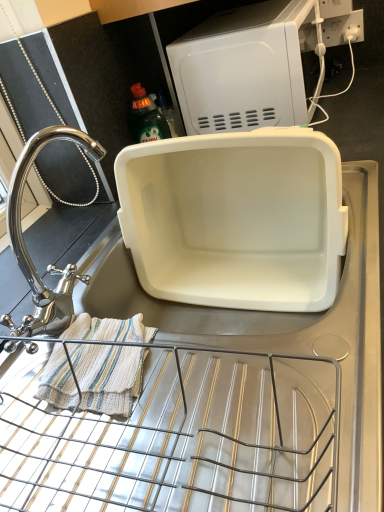
This screenshot has height=512, width=384. I want to click on polished chrome faucet at left, so click(26, 247).

This screenshot has width=384, height=512. What are the coordinates of `striped cotton towel at lower left` in the screenshot? It's located at [x=107, y=376].

Describe the element at coordinates (341, 24) in the screenshot. I see `white plastic electric outlet at upper right` at that location.

The width and height of the screenshot is (384, 512). I want to click on polished chrome faucet at left, so click(26, 247).

The image size is (384, 512). I want to click on the 1st appliance to the left of the white plastic electric outlet at upper right, starting your count from the anchor, so click(x=242, y=69).

From a real-world perspective, is white plastic electric outlet at upper right physically above white plastic microwave at upper center, the 1th appliance in the top-to-bottom sequence?

No.

From the image's perspective, is white plastic electric outlet at upper right on white plastic microwave at upper center, placed as the 2th appliance when sorted from bottom to top?

Yes, from the image's perspective, white plastic electric outlet at upper right is above white plastic microwave at upper center, placed as the 2th appliance when sorted from bottom to top.

Is white plastic electric outlet at upper right spatially inside white plastic microwave at upper center, the 1th appliance in the top-to-bottom sequence, or outside of it?

white plastic electric outlet at upper right lies outside white plastic microwave at upper center, the 1th appliance in the top-to-bottom sequence.

The width and height of the screenshot is (384, 512). What are the coordinates of `blanket on the left of white plastic container at center, the 1th appliance positioned from the bottom` in the screenshot? It's located at (107, 376).

From a real-world perspective, is striped cotton towel at lower left located higher than white plastic container at center, the 1th appliance positioned from the bottom?

Indeed, from a real-world perspective, striped cotton towel at lower left stands above white plastic container at center, the 1th appliance positioned from the bottom.

Which object is thinner, striped cotton towel at lower left or white plastic container at center, the 1th appliance positioned from the bottom?

With smaller width is striped cotton towel at lower left.

Is striped cotton towel at lower left in contact with white plastic container at center, which is the second appliance from top to bottom?

striped cotton towel at lower left is not next to white plastic container at center, which is the second appliance from top to bottom, and they're not touching.

Is white plastic microwave at upper center, placed as the 2th appliance when sorted from bottom to top, inside or outside of white plastic electric outlet at upper right?

The correct answer is: outside.

Which of these two, white plastic microwave at upper center, placed as the 2th appliance when sorted from bottom to top, or white plastic electric outlet at upper right, is wider?

Wider between the two is white plastic microwave at upper center, placed as the 2th appliance when sorted from bottom to top.

Which of these two, white plastic microwave at upper center, placed as the 2th appliance when sorted from bottom to top, or white plastic electric outlet at upper right, is bigger?

white plastic microwave at upper center, placed as the 2th appliance when sorted from bottom to top.

Is white plastic microwave at upper center, the 1th appliance in the top-to-bottom sequence, beside white plastic electric outlet at upper right?

white plastic microwave at upper center, the 1th appliance in the top-to-bottom sequence, is not next to white plastic electric outlet at upper right, and they're not touching.

I want to click on tap on the left of white plastic microwave at upper center, the 1th appliance in the top-to-bottom sequence, so click(26, 247).

Can you confirm if white plastic microwave at upper center, placed as the 2th appliance when sorted from bottom to top, is bigger than polished chrome faucet at left?

Yes.

Which is nearer, (226,188) or (71,267)?

The point (71,267) is in front.

Considering the relative sizes of white plastic container at center, which is the second appliance from top to bottom, and polished chrome faucet at left in the image provided, is white plastic container at center, which is the second appliance from top to bottom, smaller than polished chrome faucet at left?

Incorrect, white plastic container at center, which is the second appliance from top to bottom, is not smaller in size than polished chrome faucet at left.

Considering the sizes of white plastic container at center, the 1th appliance positioned from the bottom, and polished chrome faucet at left in the image, is white plastic container at center, the 1th appliance positioned from the bottom, taller or shorter than polished chrome faucet at left?

Clearly, white plastic container at center, the 1th appliance positioned from the bottom, is taller compared to polished chrome faucet at left.

Considering the sizes of objects white plastic container at center, the 1th appliance positioned from the bottom, and polished chrome faucet at left in the image provided, who is wider, white plastic container at center, the 1th appliance positioned from the bottom, or polished chrome faucet at left?

white plastic container at center, the 1th appliance positioned from the bottom.

Which of these two, white plastic electric outlet at upper right or striped cotton towel at lower left, stands shorter?

striped cotton towel at lower left.

From a real-world perspective, is white plastic electric outlet at upper right physically below striped cotton towel at lower left?

No.

In the scene shown: Considering the relative positions of white plastic electric outlet at upper right and striped cotton towel at lower left in the image provided, is white plastic electric outlet at upper right in front of striped cotton towel at lower left?

No, it is behind striped cotton towel at lower left.

Could you tell me if white plastic electric outlet at upper right is turned towards striped cotton towel at lower left?

Yes, white plastic electric outlet at upper right is oriented towards striped cotton towel at lower left.

Considering the relative positions of polished chrome faucet at left and white plastic microwave at upper center, placed as the 2th appliance when sorted from bottom to top, in the image provided, is polished chrome faucet at left to the left or to the right of white plastic microwave at upper center, placed as the 2th appliance when sorted from bottom to top,?

Clearly, polished chrome faucet at left is on the left of white plastic microwave at upper center, placed as the 2th appliance when sorted from bottom to top, in the image.

The height and width of the screenshot is (512, 384). Identify the location of the 1st appliance below the polished chrome faucet at left (from a real-world perspective). click(242, 69).

Which object is wider, polished chrome faucet at left or white plastic microwave at upper center, the 1th appliance in the top-to-bottom sequence?

white plastic microwave at upper center, the 1th appliance in the top-to-bottom sequence, is wider.

How many degrees apart are the facing directions of polished chrome faucet at left and white plastic microwave at upper center, the 1th appliance in the top-to-bottom sequence?

They differ by 0.000563 degrees in their facing directions.

This screenshot has width=384, height=512. I want to click on electric outlet above the white plastic microwave at upper center, the 1th appliance in the top-to-bottom sequence (from the image's perspective), so click(x=341, y=24).

Locate an element on the screen. This screenshot has height=512, width=384. appliance that is the 1st one when counting backward from the striped cotton towel at lower left is located at coordinates (236, 218).

Estimate the real-world distances between objects in this image. Which object is closer to white plastic container at center, which is the second appliance from top to bottom, striped cotton towel at lower left or white plastic microwave at upper center, the 1th appliance in the top-to-bottom sequence?

Based on the image, white plastic microwave at upper center, the 1th appliance in the top-to-bottom sequence, appears to be nearer to white plastic container at center, which is the second appliance from top to bottom.

Estimate the real-world distances between objects in this image. Which object is closer to polished chrome faucet at left, white plastic electric outlet at upper right or white plastic container at center, which is the second appliance from top to bottom?

Based on the image, white plastic container at center, which is the second appliance from top to bottom, appears to be nearer to polished chrome faucet at left.

When comparing their distances from polished chrome faucet at left, does white plastic container at center, the 1th appliance positioned from the bottom, or striped cotton towel at lower left seem further?

white plastic container at center, the 1th appliance positioned from the bottom, lies further to polished chrome faucet at left than the other object.

Considering their positions, is white plastic microwave at upper center, the 1th appliance in the top-to-bottom sequence, positioned closer to white plastic container at center, the 1th appliance positioned from the bottom, than polished chrome faucet at left?

Among the two, white plastic microwave at upper center, the 1th appliance in the top-to-bottom sequence, is located nearer to white plastic container at center, the 1th appliance positioned from the bottom.

Considering their positions, is striped cotton towel at lower left positioned further to white plastic electric outlet at upper right than white plastic microwave at upper center, placed as the 2th appliance when sorted from bottom to top?

striped cotton towel at lower left lies further to white plastic electric outlet at upper right than the other object.

Which object lies further to the anchor point striped cotton towel at lower left, white plastic container at center, which is the second appliance from top to bottom, or white plastic microwave at upper center, the 1th appliance in the top-to-bottom sequence?

The object further to striped cotton towel at lower left is white plastic microwave at upper center, the 1th appliance in the top-to-bottom sequence.

Based on their spatial positions, is striped cotton towel at lower left or white plastic container at center, which is the second appliance from top to bottom, further from polished chrome faucet at left?

white plastic container at center, which is the second appliance from top to bottom.

Estimate the real-world distances between objects in this image. Which object is closer to white plastic microwave at upper center, placed as the 2th appliance when sorted from bottom to top, white plastic electric outlet at upper right or polished chrome faucet at left?

white plastic electric outlet at upper right.

Identify the location of appliance between white plastic microwave at upper center, placed as the 2th appliance when sorted from bottom to top, and polished chrome faucet at left in the up-down direction. This screenshot has width=384, height=512. (236, 218).

Where is `tap between white plastic microwave at upper center, placed as the 2th appliance when sorted from bottom to top, and striped cotton towel at lower left from top to bottom`? tap between white plastic microwave at upper center, placed as the 2th appliance when sorted from bottom to top, and striped cotton towel at lower left from top to bottom is located at coordinates (26, 247).

Where is `appliance that lies between white plastic microwave at upper center, placed as the 2th appliance when sorted from bottom to top, and striped cotton towel at lower left from top to bottom`? This screenshot has width=384, height=512. appliance that lies between white plastic microwave at upper center, placed as the 2th appliance when sorted from bottom to top, and striped cotton towel at lower left from top to bottom is located at coordinates (236, 218).

The image size is (384, 512). I want to click on blanket between polished chrome faucet at left and white plastic electric outlet at upper right along the z-axis, so click(107, 376).